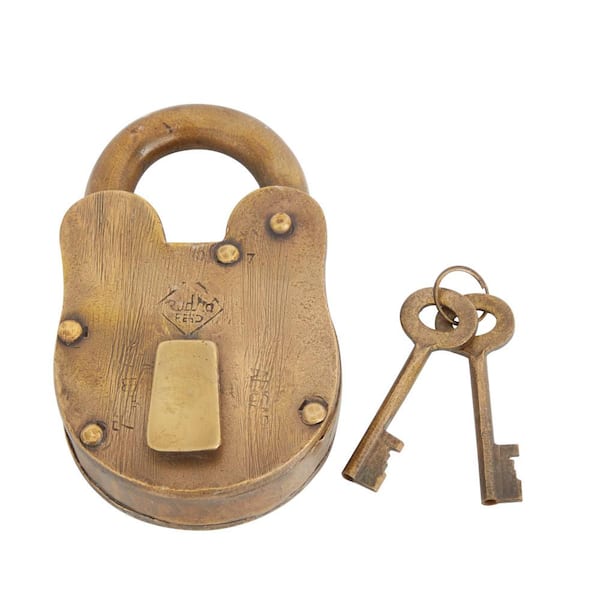
You are a GUI agent. You are given a task and a screenshot of the screen. Output one action in this format:
    pyautogui.click(x=<x>, y=<y>)
    Task: Click on the lock
    The image size is (600, 600).
    Given the screenshot: What is the action you would take?
    [165, 403]